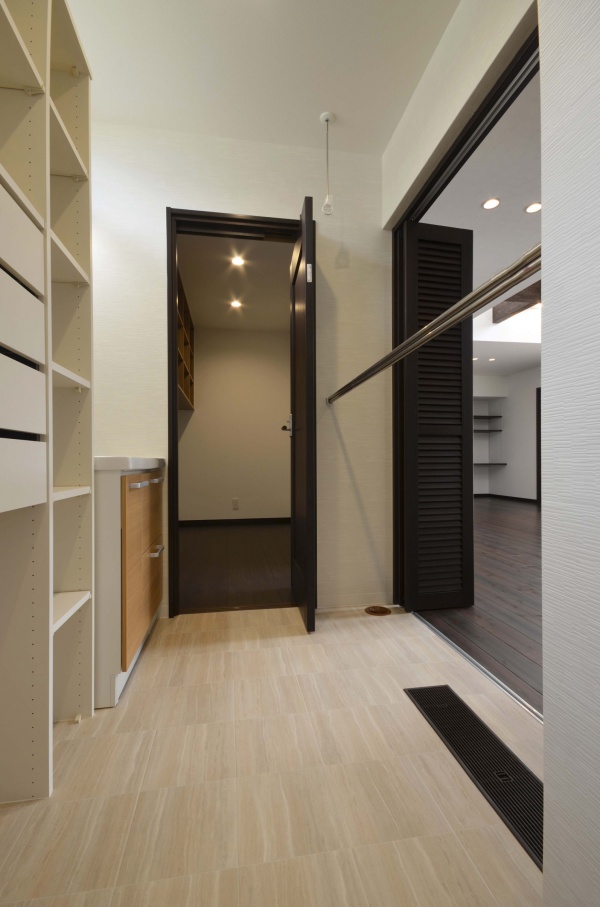
I want to click on pendant lighting, so [x=324, y=209].